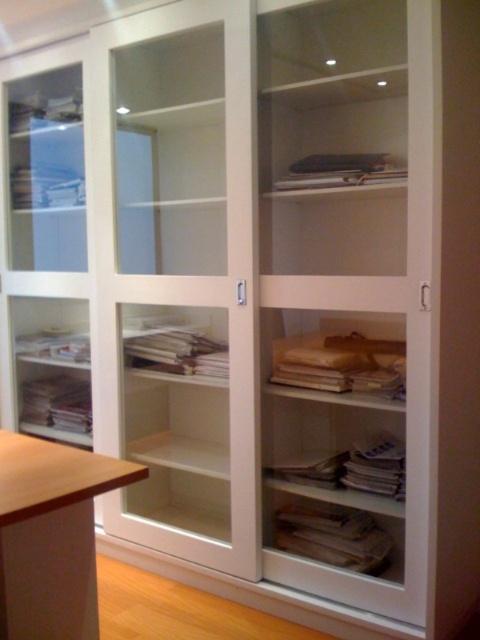
Question: Can you confirm if transparent glass cabinet at center is positioned below wooden stool at lower left?

Choices:
 (A) no
 (B) yes

Answer: (A)

Question: Observing the image, what is the correct spatial positioning of transparent glass cabinet at center in reference to wooden stool at lower left?

Choices:
 (A) right
 (B) left

Answer: (A)

Question: Which object appears closest to the camera in this image?

Choices:
 (A) wooden stool at lower left
 (B) transparent glass cabinet at center

Answer: (A)

Question: Which of the following is the closest to the observer?

Choices:
 (A) wooden stool at lower left
 (B) transparent glass cabinet at center

Answer: (A)

Question: Can you confirm if transparent glass cabinet at center is positioned below wooden stool at lower left?

Choices:
 (A) yes
 (B) no

Answer: (B)